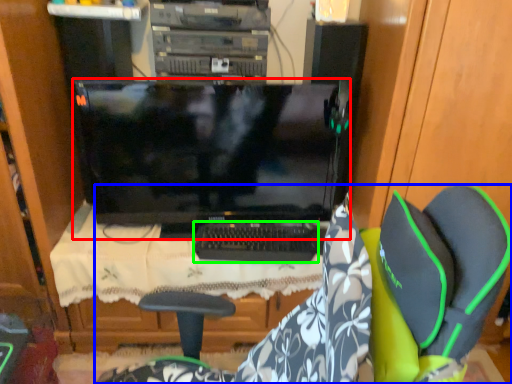
Question: Which object is positioned closest to computer monitor (highlighted by a red box)? Select from chair (highlighted by a blue box) and computer keyboard (highlighted by a green box).

Choices:
 (A) chair
 (B) computer keyboard

Answer: (B)